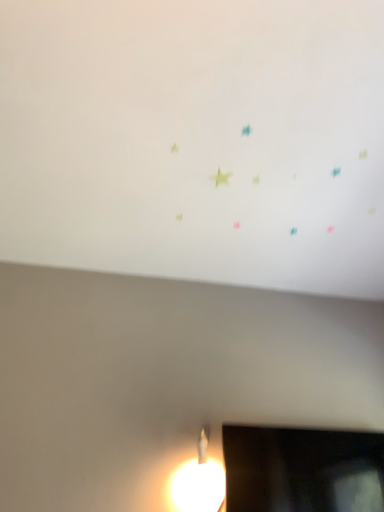
What is the approximate width of black glossy television at lower right?

The width of black glossy television at lower right is 3.56 inches.

The height and width of the screenshot is (512, 384). What do you see at coordinates (302, 470) in the screenshot?
I see `black glossy television at lower right` at bounding box center [302, 470].

Where is `black glossy television at lower right`? This screenshot has width=384, height=512. black glossy television at lower right is located at coordinates (302, 470).

Measure the distance between black glossy television at lower right and camera.

1.41 meters.

Describe the element at coordinates (196, 141) in the screenshot. I see `white matte wall at upper center` at that location.

Where is `white matte wall at upper center`? This screenshot has width=384, height=512. white matte wall at upper center is located at coordinates (196, 141).

Image resolution: width=384 pixels, height=512 pixels. Identify the location of black glossy television at lower right. (302, 470).

Which object is positioned more to the right, white matte wall at upper center or black glossy television at lower right?

Positioned to the right is black glossy television at lower right.

Is the depth of white matte wall at upper center greater than that of black glossy television at lower right?

No, white matte wall at upper center is in front of black glossy television at lower right.

Considering the points (270, 22) and (251, 492), which point is in front, point (270, 22) or point (251, 492)?

The point (270, 22) is more forward.

From the image's perspective, is white matte wall at upper center above or below black glossy television at lower right?

Based on their image positions, white matte wall at upper center is located above black glossy television at lower right.

From a real-world perspective, is white matte wall at upper center physically below black glossy television at lower right?

Actually, white matte wall at upper center is physically above black glossy television at lower right in the real world.

Considering the sizes of objects white matte wall at upper center and black glossy television at lower right in the image provided, who is thinner, white matte wall at upper center or black glossy television at lower right?

Thinner between the two is black glossy television at lower right.

Considering the sizes of objects white matte wall at upper center and black glossy television at lower right in the image provided, who is taller, white matte wall at upper center or black glossy television at lower right?

black glossy television at lower right is taller.

Can you confirm if white matte wall at upper center is bigger than black glossy television at lower right?

Correct, white matte wall at upper center is larger in size than black glossy television at lower right.

Does white matte wall at upper center contain black glossy television at lower right?

No.

Is white matte wall at upper center positioned far away from black glossy television at lower right?

No, white matte wall at upper center is in close proximity to black glossy television at lower right.

Is white matte wall at upper center looking in the opposite direction of black glossy television at lower right?

That's not correct — white matte wall at upper center is not looking away from black glossy television at lower right.

How many degrees apart are the facing directions of white matte wall at upper center and black glossy television at lower right?

There is a 90.2-degree angle between the facing directions of white matte wall at upper center and black glossy television at lower right.

The image size is (384, 512). What are the coordinates of `television on the right of white matte wall at upper center` in the screenshot? It's located at (302, 470).

Is black glossy television at lower right to the right of white matte wall at upper center from the viewer's perspective?

Yes, black glossy television at lower right is to the right of white matte wall at upper center.

Does black glossy television at lower right lie in front of white matte wall at upper center?

No, it is not.

Is point (308, 435) positioned before point (114, 205)?

No, it is not.

Consider the image. From the image's perspective, which is below, black glossy television at lower right or white matte wall at upper center?

black glossy television at lower right, from the image's perspective.

From a real-world perspective, is black glossy television at lower right positioned above or below white matte wall at upper center?

Clearly, from a real-world perspective, black glossy television at lower right is below white matte wall at upper center.

Considering the sizes of objects black glossy television at lower right and white matte wall at upper center in the image provided, who is thinner, black glossy television at lower right or white matte wall at upper center?

black glossy television at lower right is thinner.

Considering the sizes of objects black glossy television at lower right and white matte wall at upper center in the image provided, who is shorter, black glossy television at lower right or white matte wall at upper center?

With less height is white matte wall at upper center.

In terms of size, does black glossy television at lower right appear bigger or smaller than white matte wall at upper center?

Considering their sizes, black glossy television at lower right takes up less space than white matte wall at upper center.

Is black glossy television at lower right outside of white matte wall at upper center?

black glossy television at lower right is positioned outside white matte wall at upper center.

Is black glossy television at lower right not close to white matte wall at upper center?

They are positioned close to each other.

Is black glossy television at lower right facing towards white matte wall at upper center?

No, black glossy television at lower right is not facing towards white matte wall at upper center.

What's the angular difference between black glossy television at lower right and white matte wall at upper center's facing directions?

The angular difference between black glossy television at lower right and white matte wall at upper center is 90.2 degrees.

Locate an element on the screen. The width and height of the screenshot is (384, 512). television on the right of white matte wall at upper center is located at coordinates (302, 470).

In the image, there is a white matte wall at upper center. Where is `television below it (from a real-world perspective)`? The height and width of the screenshot is (512, 384). television below it (from a real-world perspective) is located at coordinates (302, 470).

Locate an element on the screen. This screenshot has width=384, height=512. backdrop in front of the black glossy television at lower right is located at coordinates (196, 141).